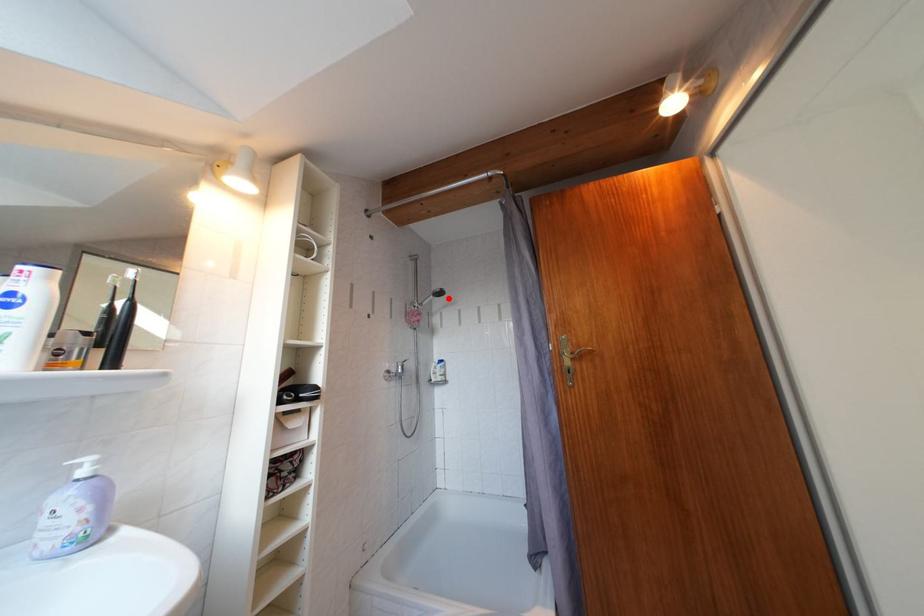
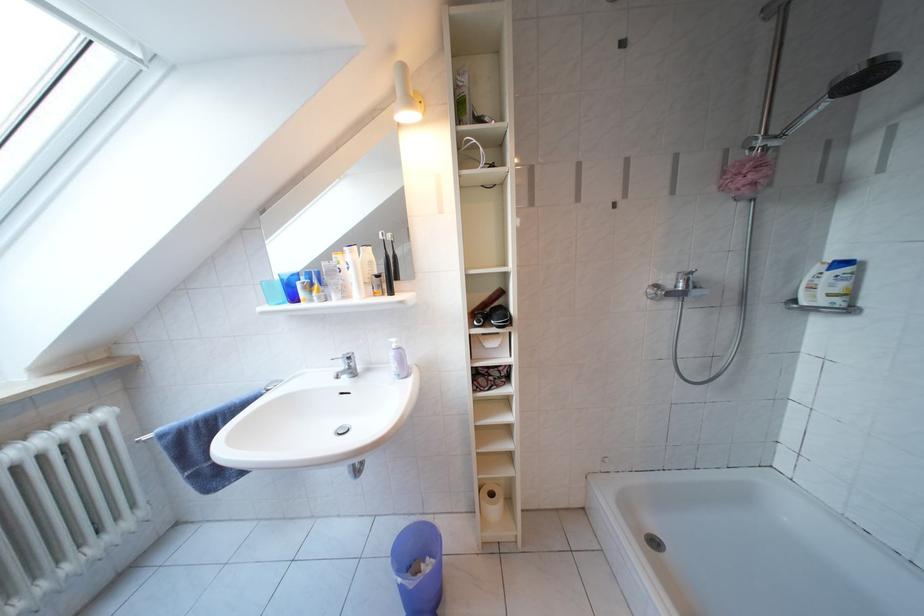
Find the pixel in the second image that matches the highlighted location in the first image.

(876, 82)